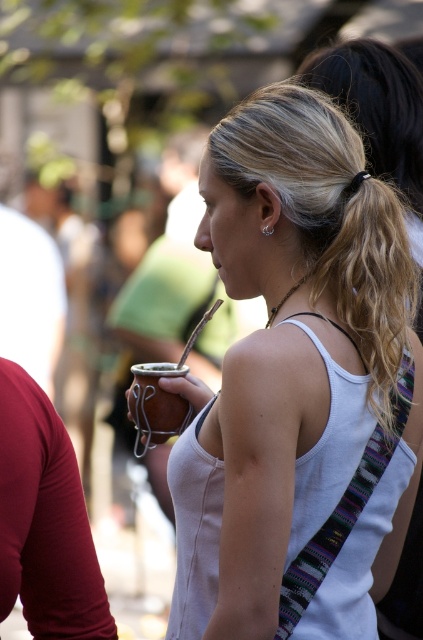
Question: Which object is closer to the camera taking this photo?

Choices:
 (A) matte brown cup at center
 (B) matte brown leather purse at center

Answer: (B)

Question: From the image, what is the correct spatial relationship of matte brown leather purse at center in relation to matte brown cup at center?

Choices:
 (A) below
 (B) above

Answer: (A)

Question: Which object is farther from the camera taking this photo?

Choices:
 (A) matte brown cup at center
 (B) matte brown leather purse at center
 (C) brown leather mate at center

Answer: (A)

Question: Which point is farther to the camera?

Choices:
 (A) brown leather mate at center
 (B) matte brown leather purse at center

Answer: (A)

Question: Can you confirm if matte brown leather purse at center is positioned to the right of matte brown cup at center?

Choices:
 (A) yes
 (B) no

Answer: (A)

Question: Does matte brown cup at center come behind brown leather mate at center?

Choices:
 (A) no
 (B) yes

Answer: (B)